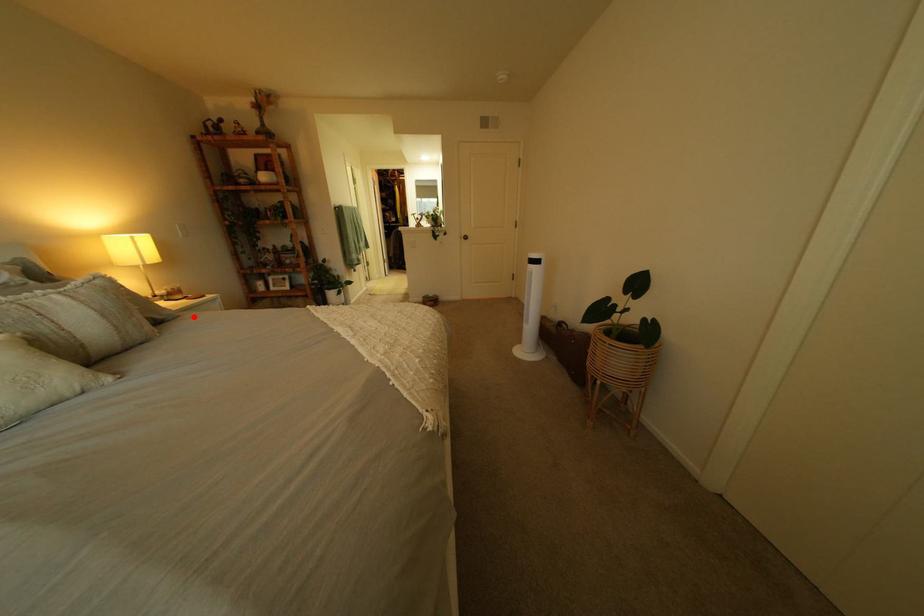
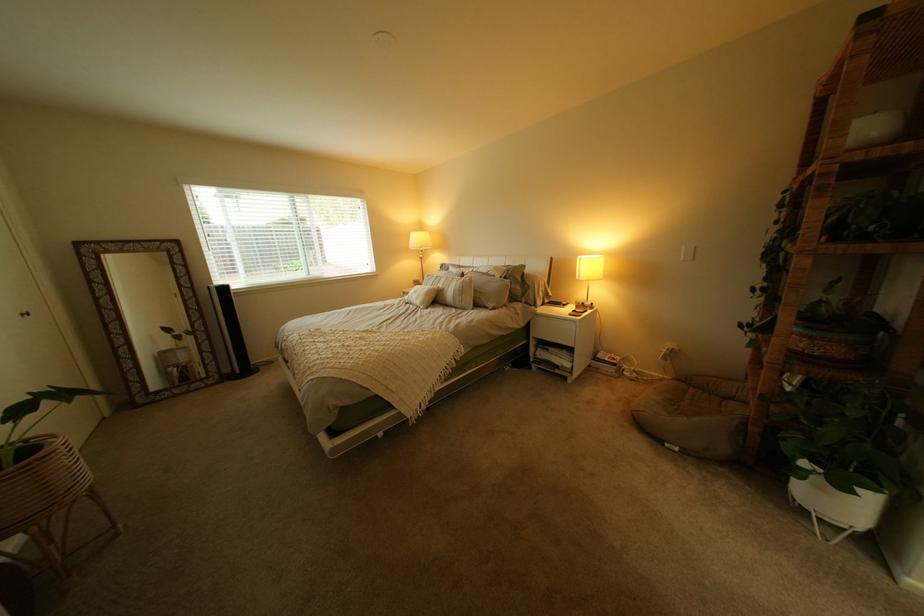
Question: I am providing you with two images of the same scene from different viewpoints. Given a red point in image1, look at the same physical point in image2. Is it:

Choices:
 (A) Closer to the viewpoint
 (B) Farther from the viewpoint

Answer: (B)